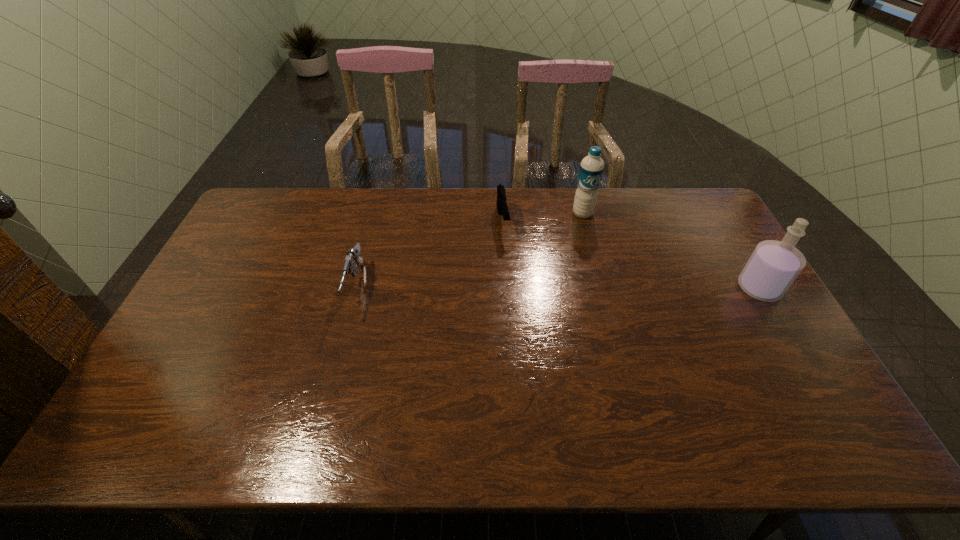
At what (x,y) coordinates should I click in order to perform the action: click on vacant space that is in between the gun and the rightmost object. Please return your answer as a coordinate pair (x, y). The height and width of the screenshot is (540, 960). Looking at the image, I should click on (558, 288).

Identify the location of free space between the rightmost object and the pistol. (631, 255).

At what (x,y) coordinates should I click in order to perform the action: click on free point between the second object from left to right and the rightmost object. Please return your answer as a coordinate pair (x, y). The image size is (960, 540). Looking at the image, I should click on (631, 255).

Image resolution: width=960 pixels, height=540 pixels. Find the location of `vacant region between the second object from left to right and the perfume`. vacant region between the second object from left to right and the perfume is located at coordinates (631, 255).

Find the location of a particular element. The height and width of the screenshot is (540, 960). vacant area that lies between the perfume and the water bottle is located at coordinates (671, 251).

This screenshot has height=540, width=960. Identify the location of vacant region between the gun and the second object from left to right. (429, 254).

Where is `vacant area between the perfume and the second object from left to right`? The width and height of the screenshot is (960, 540). vacant area between the perfume and the second object from left to right is located at coordinates pyautogui.click(x=631, y=255).

This screenshot has width=960, height=540. In order to click on vacant point located between the pistol and the rightmost object in this screenshot , I will do `click(631, 255)`.

Find the location of a particular element. The height and width of the screenshot is (540, 960). free space between the perfume and the gun is located at coordinates (558, 288).

Identify the location of free spot between the perfume and the third object from left to right. (671, 251).